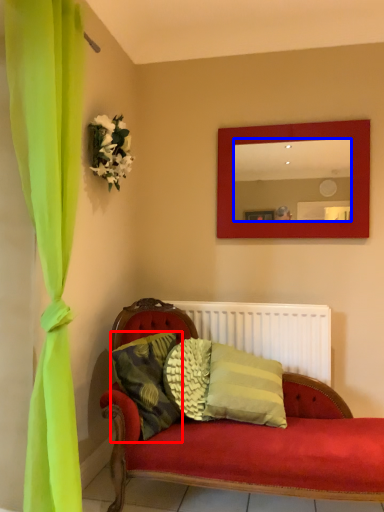
Question: Among these objects, which one is nearest to the camera, pillow (highlighted by a red box) or mirror (highlighted by a blue box)?

Choices:
 (A) pillow
 (B) mirror

Answer: (A)